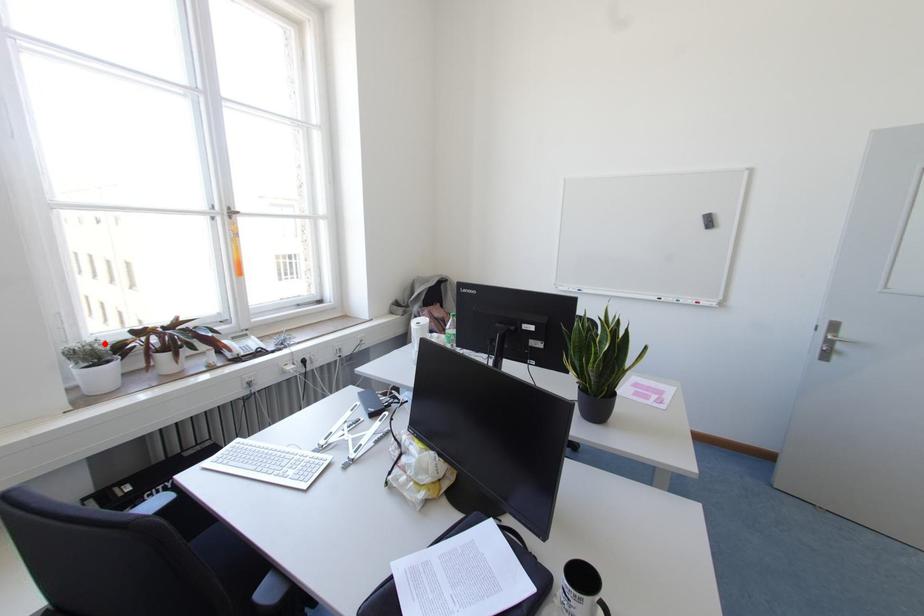
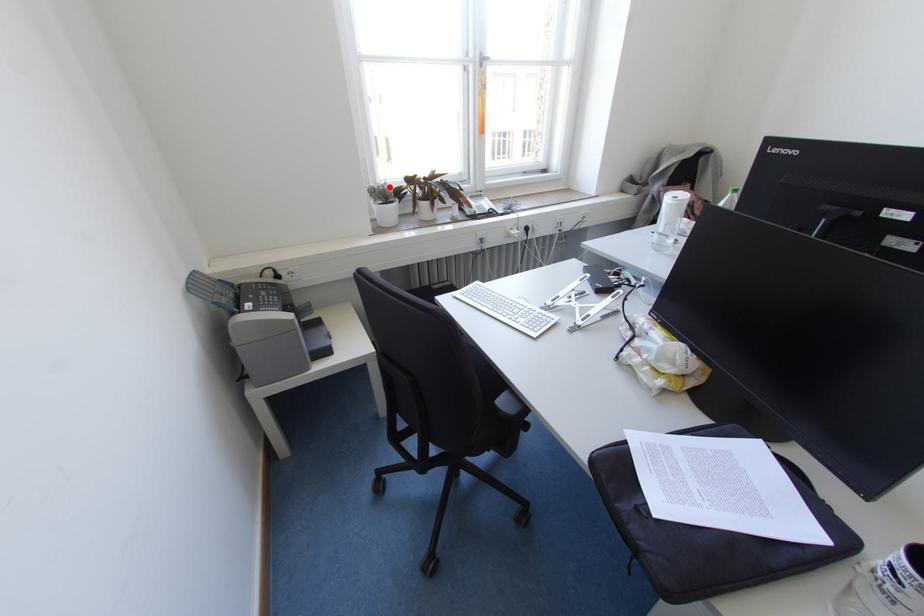
I am providing you with two images of the same scene from different viewpoints. A red point is marked on the first image and another point is marked on the second image. Does the point marked in image1 correspond to the same location as the one in image2?

Yes